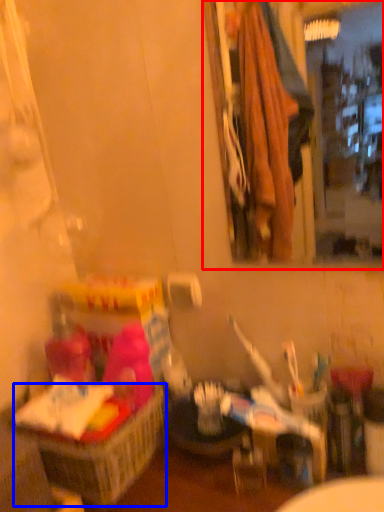
Question: Which of the following is the farthest to the observer, mirror (highlighted by a red box) or basket (highlighted by a blue box)?

Choices:
 (A) mirror
 (B) basket

Answer: (B)